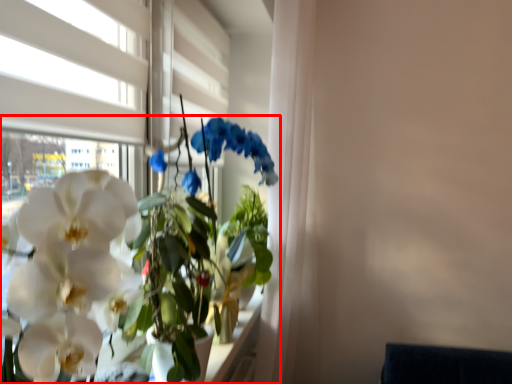
Question: From the image's perspective, what is the correct spatial relationship of houseplant (annotated by the red box) in relation to window?

Choices:
 (A) above
 (B) below

Answer: (B)